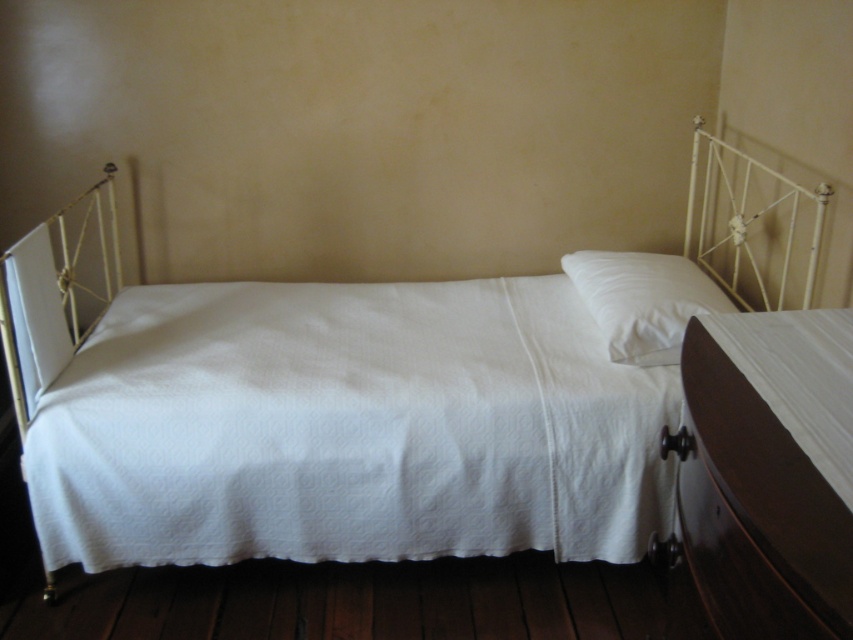
Question: Which object is closer to the camera taking this photo?

Choices:
 (A) white quilted fabric at center
 (B) white metal headboard at upper right

Answer: (B)

Question: Can you confirm if white metal headboard at upper right is positioned above white soft pillow at center?

Choices:
 (A) yes
 (B) no

Answer: (A)

Question: Which object is the farthest from the white soft pillow at center?

Choices:
 (A) white metal headboard at upper right
 (B) white quilted fabric at center

Answer: (B)

Question: Does white metal headboard at upper right appear over white soft pillow at center?

Choices:
 (A) no
 (B) yes

Answer: (B)

Question: Estimate the real-world distances between objects in this image. Which object is closer to the white soft pillow at center?

Choices:
 (A) white metal headboard at upper right
 (B) white quilted fabric at center

Answer: (A)

Question: Can you confirm if white metal headboard at upper right is wider than white soft pillow at center?

Choices:
 (A) yes
 (B) no

Answer: (B)